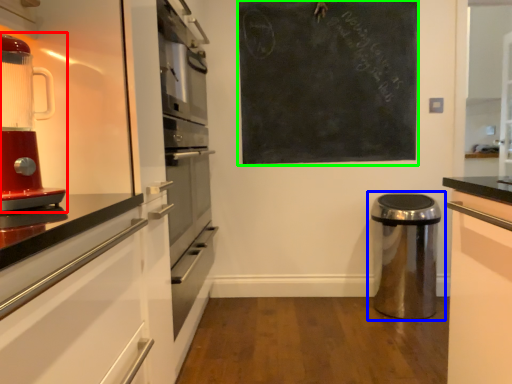
Question: Considering the real-world distances, which object is closest to home appliance (highlighted by a red box)? waste container (highlighted by a blue box) or bulletin board (highlighted by a green box).

Choices:
 (A) waste container
 (B) bulletin board

Answer: (B)